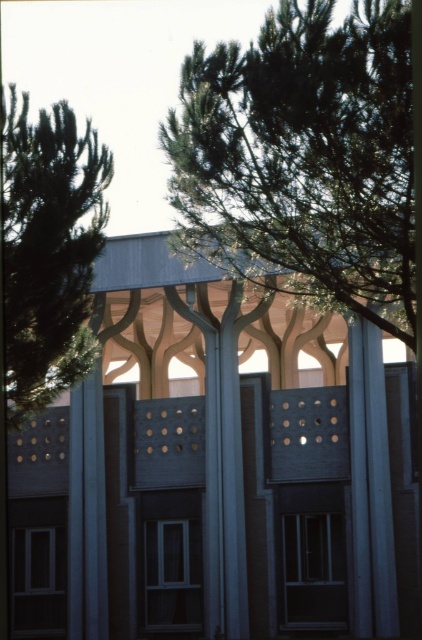
Question: Does green leafy tree at upper center have a larger size compared to green needle-like leaves at upper left?

Choices:
 (A) no
 (B) yes

Answer: (A)

Question: Is green leafy tree at upper center smaller than green needle-like leaves at upper left?

Choices:
 (A) yes
 (B) no

Answer: (A)

Question: Does green leafy tree at upper center appear over green needle-like leaves at upper left?

Choices:
 (A) yes
 (B) no

Answer: (B)

Question: Among these objects, which one is farthest from the camera?

Choices:
 (A) green needle-like leaves at upper left
 (B) green leafy tree at upper center

Answer: (B)